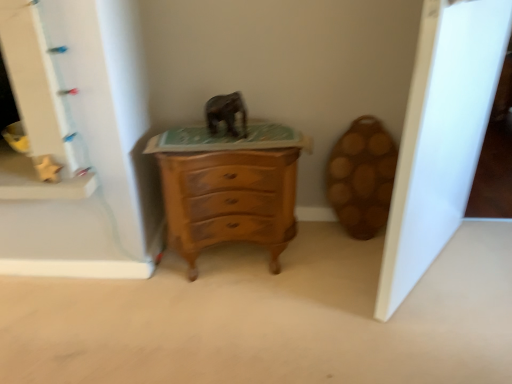
Identify the location of vacant space to the right of matte gray elephant at center. This screenshot has width=512, height=384. (271, 135).